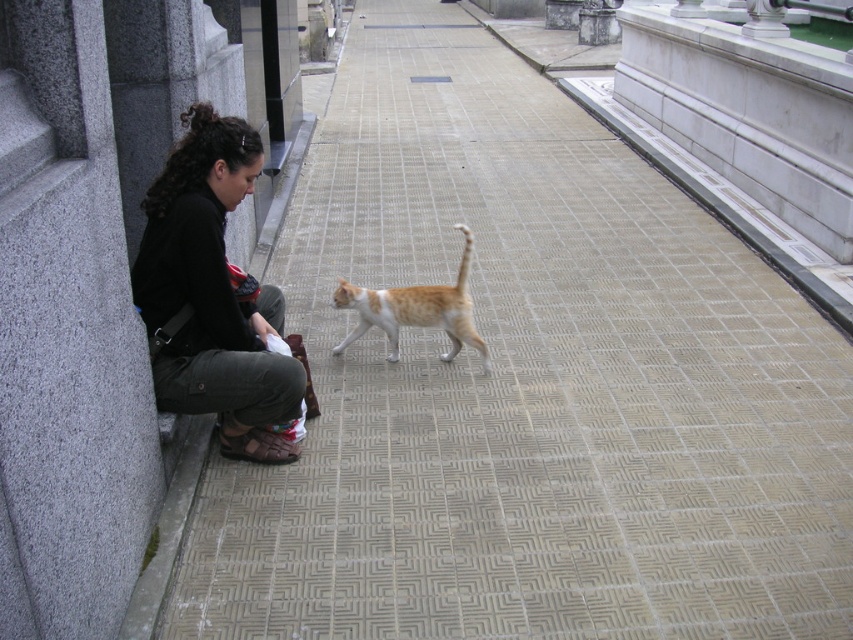
You are standing at the origin point of the coordinate system where the image is centered. You see the point at coordinates (212, 294). What object is located at that point?

The point at coordinates (212, 294) is located on the dark brown leather jacket at lower left.

You are a photographer standing at the edge of the tiled pathway. You want to capture a photo of the orange fur cat at center without the dark brown leather jacket at lower left appearing in the foreground. Is the jacket likely to block your view of the cat?

The dark brown leather jacket at lower left is taller than orange fur cat at center, so it might block the view of the cat if positioned between the photographer and the cat. Adjust your angle or position to ensure the jacket does not obscure the cat.

You are a delivery robot with a 24 inch wide package. You need to move from the dark brown leather jacket at lower left to the orange fur cat at center. Is there enough space between them for you to pass through?

The distance between the dark brown leather jacket at lower left and the orange fur cat at center is 30.61 inches. Since the package is 24 inches wide, there is sufficient space for the robot to pass through.